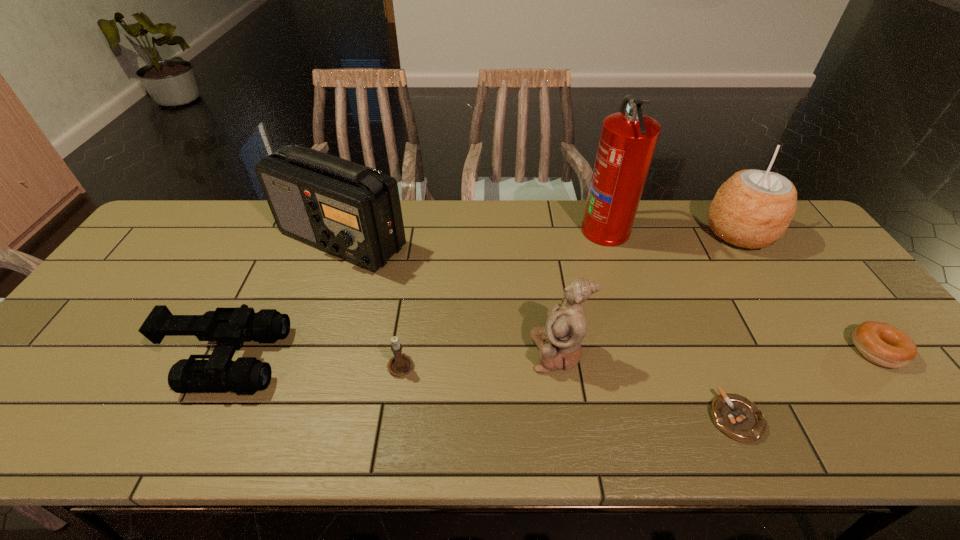
Identify the location of free region located 0.400m on the side of the third shortest object with the handle. This screenshot has height=540, width=960. (419, 244).

I want to click on free space located on the side of the third shortest object with the handle, so click(417, 257).

Locate an element on the screen. vacant space located 0.310m on the side of the third shortest object with the handle is located at coordinates (416, 264).

Locate an element on the screen. The height and width of the screenshot is (540, 960). vacant region located on the back of the bagel is located at coordinates (825, 282).

Locate an element on the screen. This screenshot has width=960, height=540. free space located 0.090m on the back of the ashtray is located at coordinates (710, 360).

In order to click on fire extinguisher that is at the far edge in this screenshot , I will do `click(628, 140)`.

Identify the location of radio receiver that is positioned at the far edge. (352, 211).

The height and width of the screenshot is (540, 960). I want to click on coconut that is positioned at the far edge, so click(752, 209).

This screenshot has height=540, width=960. Find the location of `object positioned at the near edge`. object positioned at the near edge is located at coordinates (736, 416).

The height and width of the screenshot is (540, 960). I want to click on coconut that is positioned at the right edge, so click(752, 209).